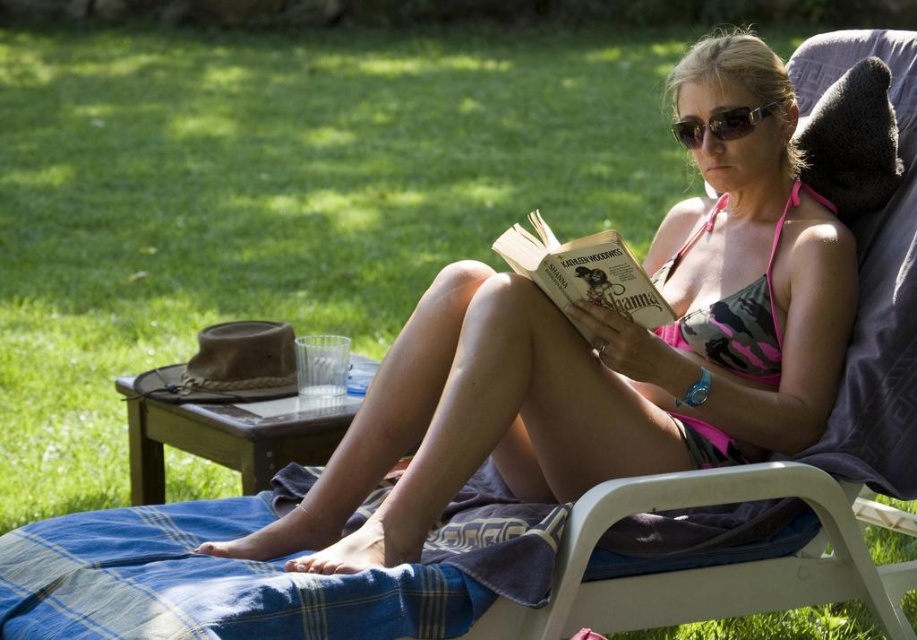
You are a photographer trying to capture the blue plaid blanket at lower center and the black plastic sunglasses at center in the same frame. Which object should you focus on first if you want both to be in focus without moving the camera?

You should focus on the black plastic sunglasses at center first because it is closer to the camera than the blue plaid blanket at lower center, ensuring both will be in focus when using a single focal point.

You are a photographer taking a picture of the woman in the scene. You want to ensure both the pink camouflage bikini at center and the black plastic sunglasses at center are clearly visible. Since you can only focus on one object at a time, which object should you focus on to ensure the other is still in the frame?

The pink camouflage bikini at center is bigger than the black plastic sunglasses at center, so focusing on the pink camouflage bikini at center will ensure the smaller black plastic sunglasses at center remains in the frame.